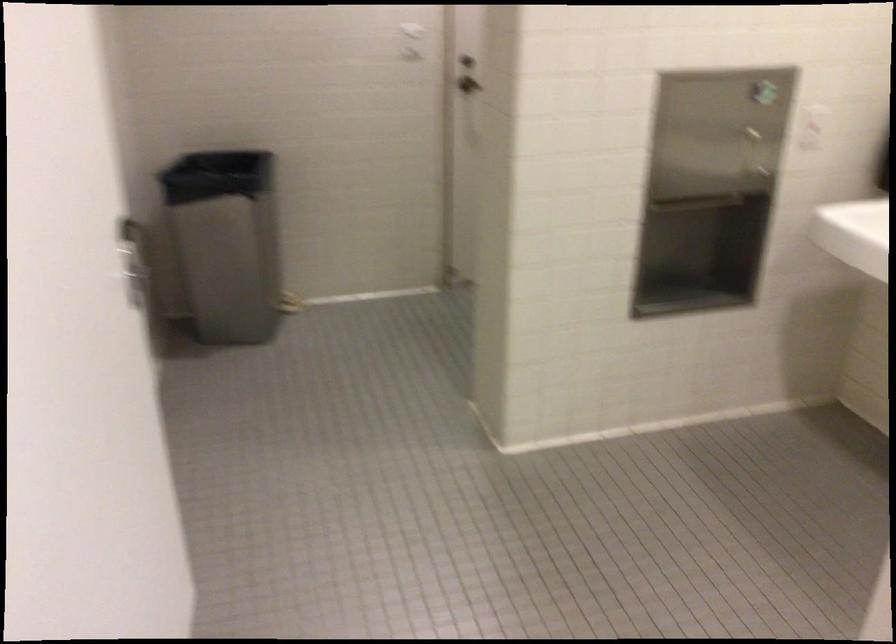
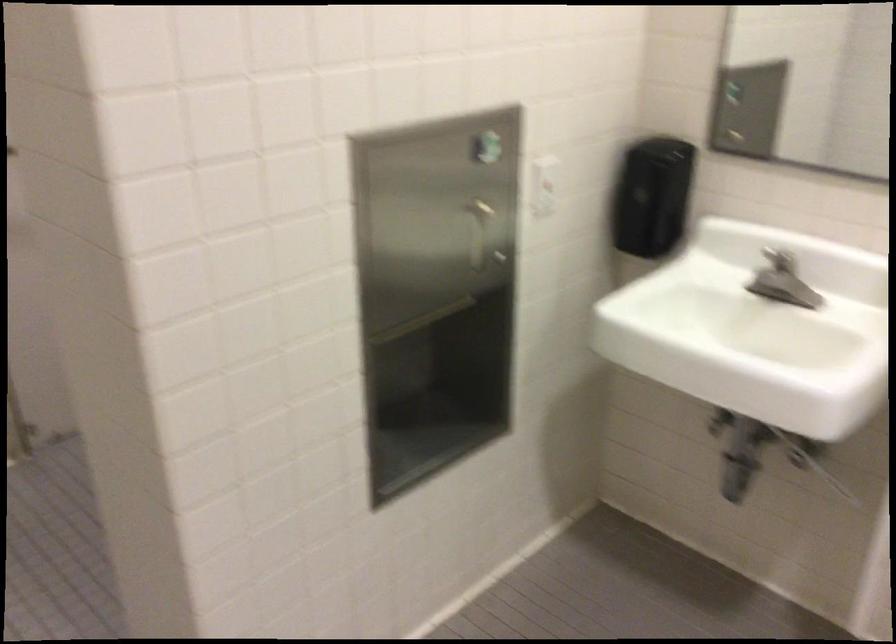
Find the pixel in the second image that matches [769,102] in the first image.

(493, 175)